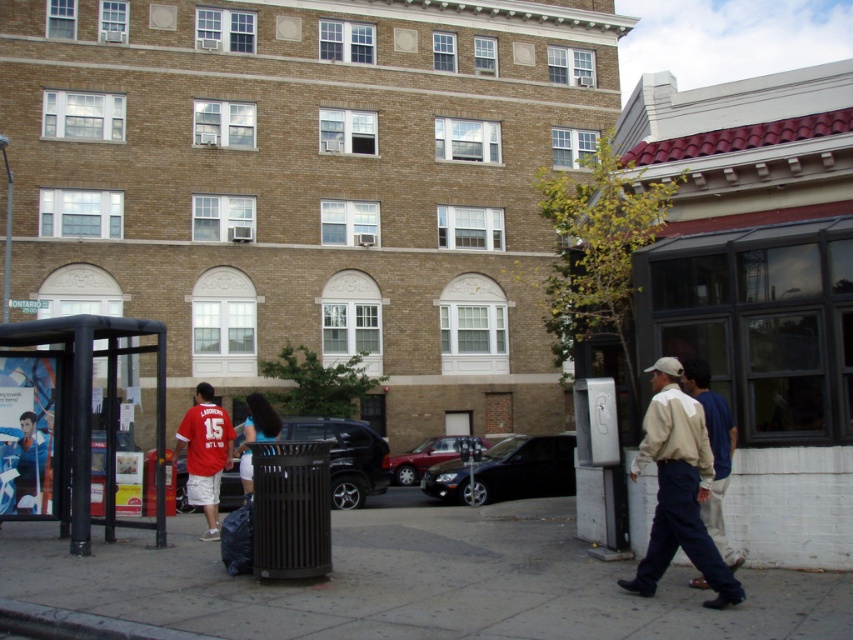
The height and width of the screenshot is (640, 853). I want to click on gray concrete sidewalk at lower center, so click(413, 580).

Between gray concrete sidewalk at lower center and shiny black suv at center, which one is positioned lower?

Positioned lower is shiny black suv at center.

Which is in front, point (469, 588) or point (387, 448)?

Positioned in front is point (469, 588).

Find the location of a particular element. gray concrete sidewalk at lower center is located at coordinates (413, 580).

Is white cotton shirt at center bigger than blue fabric shirt at center?

No, white cotton shirt at center is not bigger than blue fabric shirt at center.

Between white cotton shirt at center and blue fabric shirt at center, which one is positioned higher?

white cotton shirt at center

Between point (699, 362) and point (239, 456), which one is positioned behind?

Point (239, 456)

Locate an element on the screen. This screenshot has width=853, height=640. white cotton shirt at center is located at coordinates (714, 451).

Describe the element at coordinates (677, 488) in the screenshot. I see `light beige sweater at center` at that location.

Is light beige sweater at center above shiny black suv at center?

Yes, light beige sweater at center is above shiny black suv at center.

Is point (680, 474) less distant than point (292, 436)?

That is True.

Identify the location of light beige sweater at center. Image resolution: width=853 pixels, height=640 pixels. (677, 488).